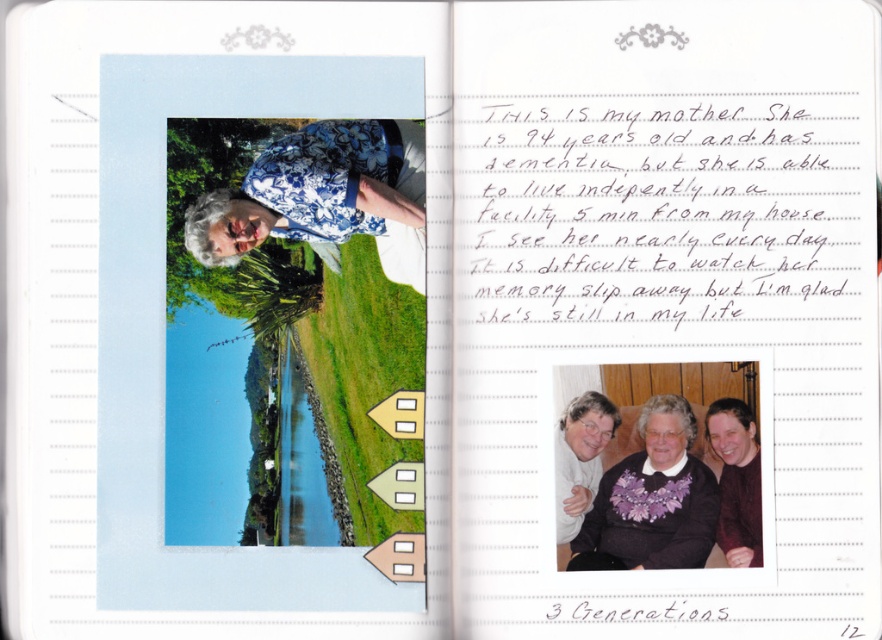
You are organizing a clothing donation drive and need to determine which item takes up more space. Based on the image, which of the two items, the blue floral shirt at center or the maroon sweater at center, is bigger in size?

The blue floral shirt at center is larger in size than the maroon sweater at center, so it takes up more space.

Based on the photo, you are designing a layout for a scrapbook page and want to ensure that the purple fabric at center and the maroon sweater at center are spaced appropriately. Given that the minimum required distance between these two elements for readability is 3 centimeters, will the current placement meet this requirement?

The purple fabric at center is 2.83 centimeters away from the maroon sweater at center, which is less than the required 3 centimeters. Therefore, the current placement does not meet the readability requirement and needs adjustment.

You are organizing a clothing sale and have two items displayed side by side on a table in the scene described. The items are the blue floral shirt at center and the purple fabric at center. Based on the scene, can you determine which item is wider?

The blue floral shirt at center might be wider than purple fabric at center, so it is possible that the blue floral shirt at center is wider.